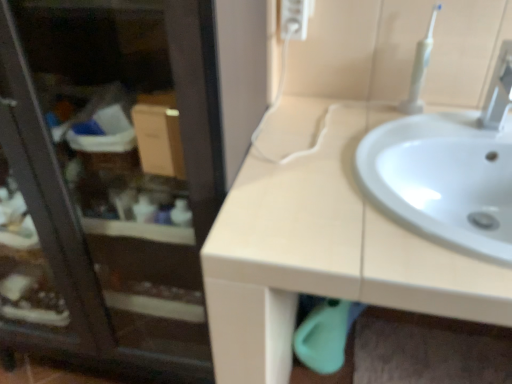
Find the location of a particular element. The width and height of the screenshot is (512, 384). free space above beige matte sink at upper right (from a real-world perspective) is located at coordinates (380, 163).